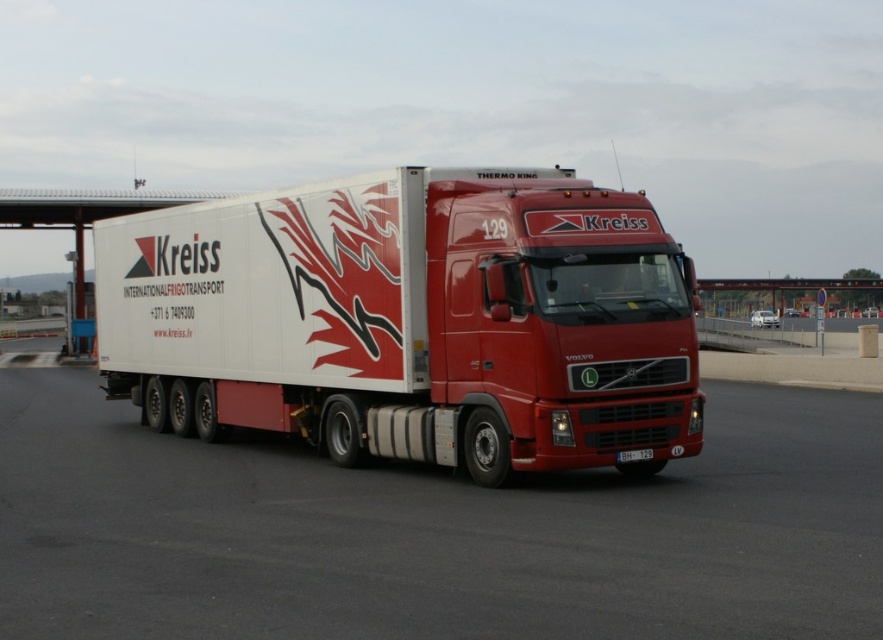
Is white glossy trailer at center positioned behind black plastic license plate at center?

No, white glossy trailer at center is closer to the viewer.

Between white glossy trailer at center and black plastic license plate at center, which one appears on the left side from the viewer's perspective?

white glossy trailer at center is more to the left.

Locate an element on the screen. The height and width of the screenshot is (640, 883). white glossy trailer at center is located at coordinates (410, 321).

Is white glossy truck at center to the left of white glossy trailer at center from the viewer's perspective?

In fact, white glossy truck at center is to the right of white glossy trailer at center.

Between white glossy truck at center and white glossy trailer at center, which one is positioned lower?

white glossy truck at center is lower down.

Between point (668, 541) and point (448, 376), which one is positioned in front?

Positioned in front is point (668, 541).

At what (x,y) coordinates should I click in order to perform the action: click on white glossy truck at center. Please return your answer as a coordinate pair (x, y). Looking at the image, I should click on (434, 532).

Is white glossy truck at center to the left of black plastic license plate at center from the viewer's perspective?

Indeed, white glossy truck at center is positioned on the left side of black plastic license plate at center.

Does white glossy truck at center lie in front of black plastic license plate at center?

Yes, it is.

Is point (42, 634) positioned after point (632, 458)?

That is False.

Locate an element on the screen. white glossy truck at center is located at coordinates (434, 532).